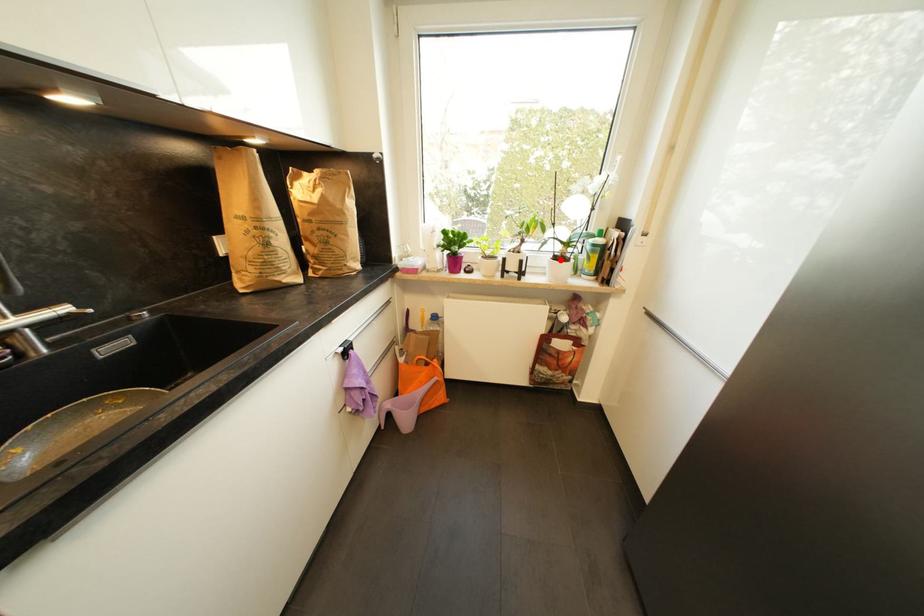
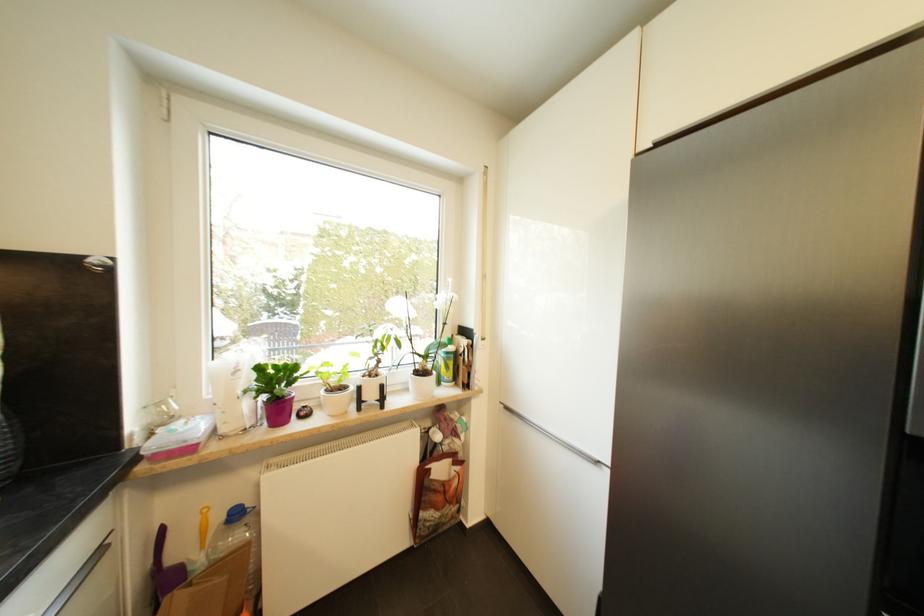
Question: I am providing you with two images of the same scene from different viewpoints. In image1, a red point is highlighted. Considering the same 3D point in image2, which of the following is correct?

Choices:
 (A) It is closer
 (B) It is farther

Answer: (B)